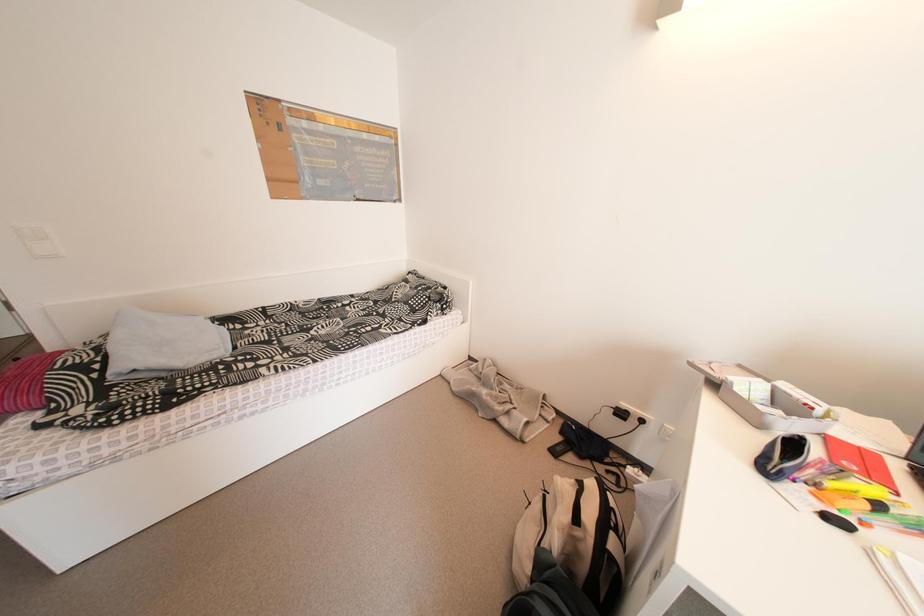
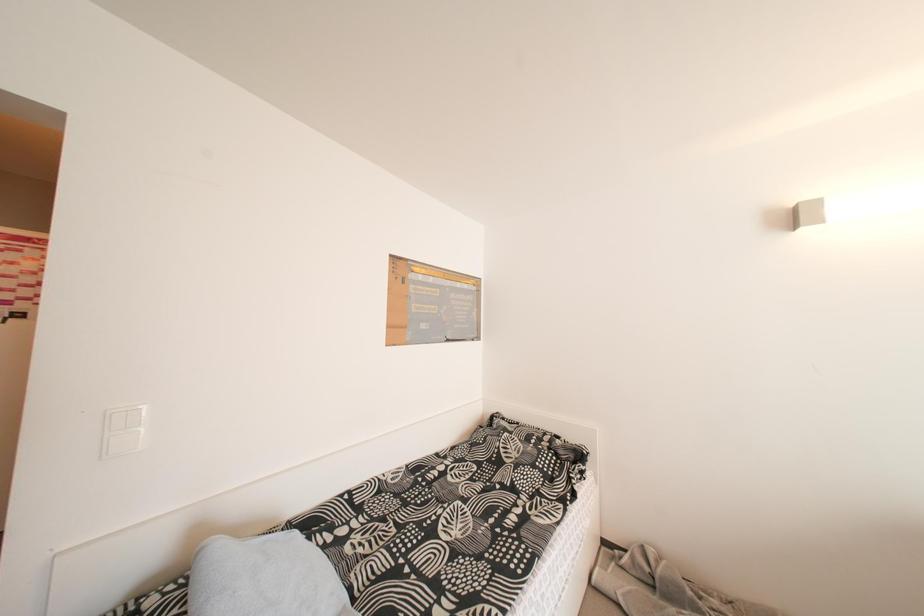
Question: Which direction would the cameraman need to move to produce the second image? Reply with the corresponding letter.

Choices:
 (A) Left
 (B) Right
 (C) Forward
 (D) Backward

Answer: (A)